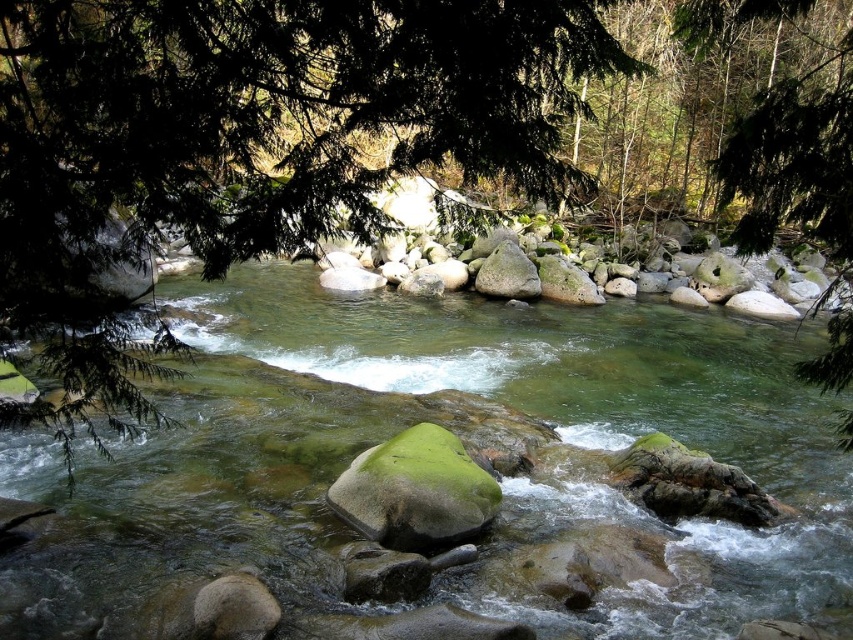
Question: Which of the following is the closest to the observer?

Choices:
 (A) (32, 26)
 (B) (387, 445)

Answer: (A)

Question: Can you confirm if green leafy tree at upper left is positioned to the left of green mossy rock at center?

Choices:
 (A) yes
 (B) no

Answer: (A)

Question: Which of the following is the farthest from the observer?

Choices:
 (A) smooth gray rock at center
 (B) translucent green water at center
 (C) green mossy rock at center
 (D) green leafy tree at upper left

Answer: (A)

Question: Which object is closer to the camera taking this photo?

Choices:
 (A) translucent green water at center
 (B) smooth gray rock at center
 (C) green mossy rock at center

Answer: (A)

Question: Is green mossy rock at center bigger than smooth gray rock at center?

Choices:
 (A) yes
 (B) no

Answer: (B)

Question: Does green mossy rock at center come behind smooth gray rock at center?

Choices:
 (A) yes
 (B) no

Answer: (B)